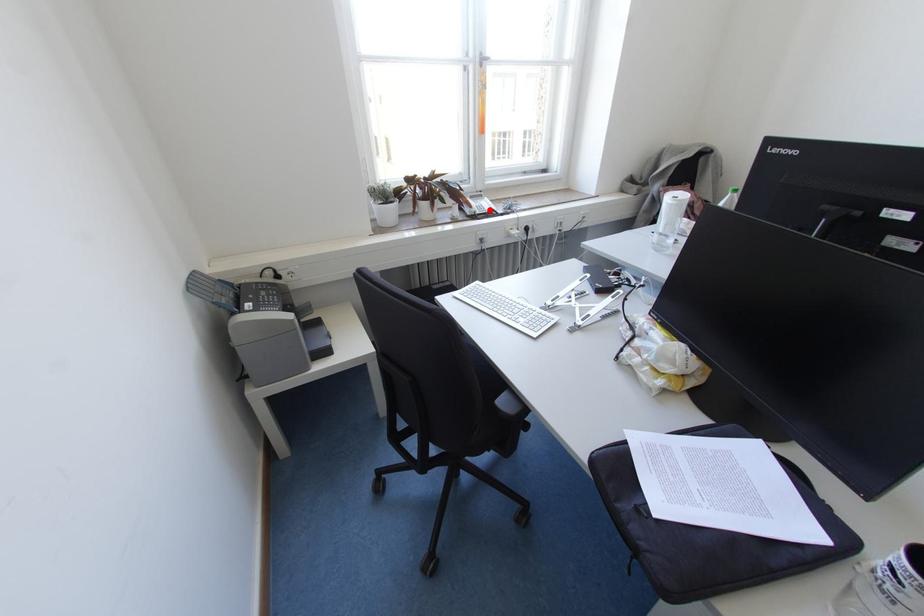
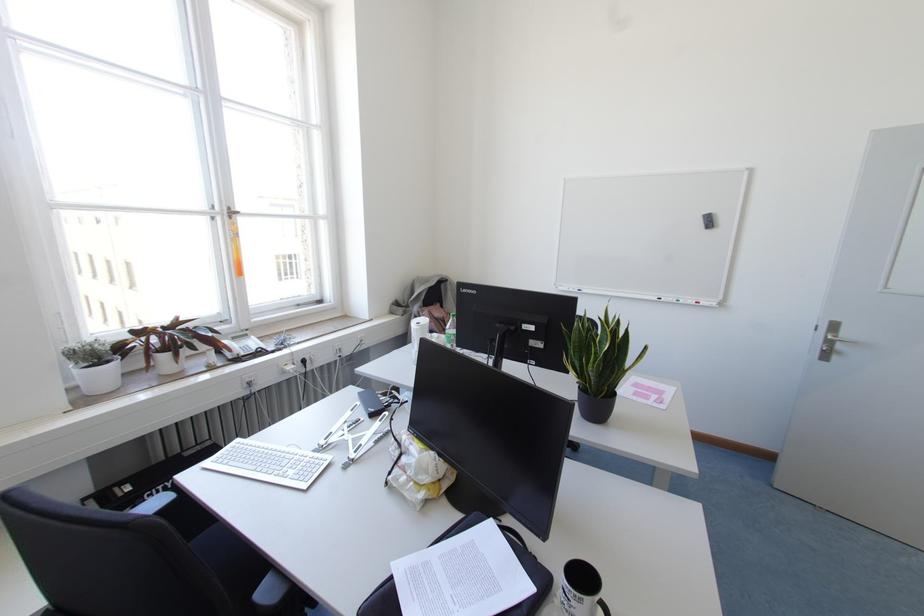
Find the pixel in the second image that matches the highlighted location in the first image.

(258, 349)